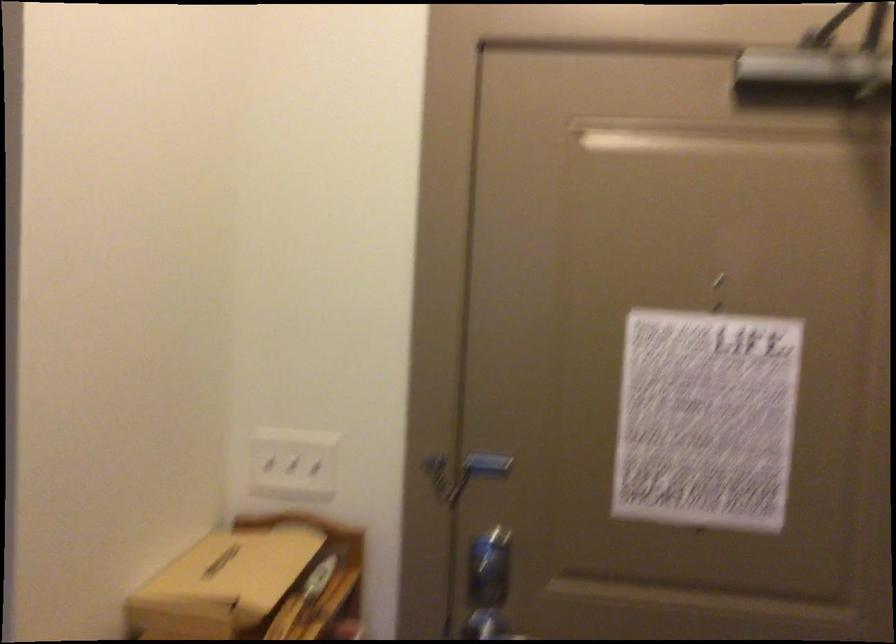
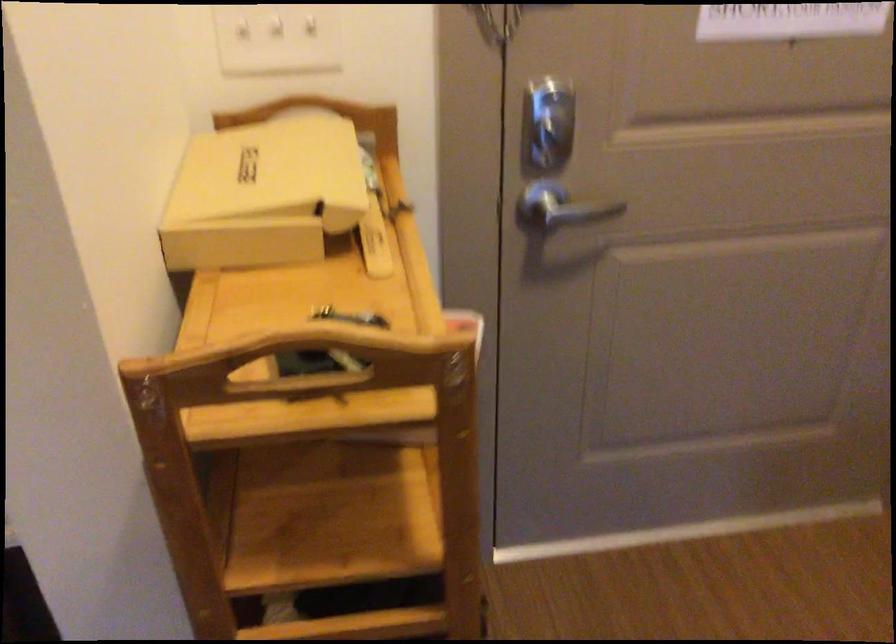
The point at (487, 567) is marked in the first image. Where is the corresponding point in the second image?

(547, 122)